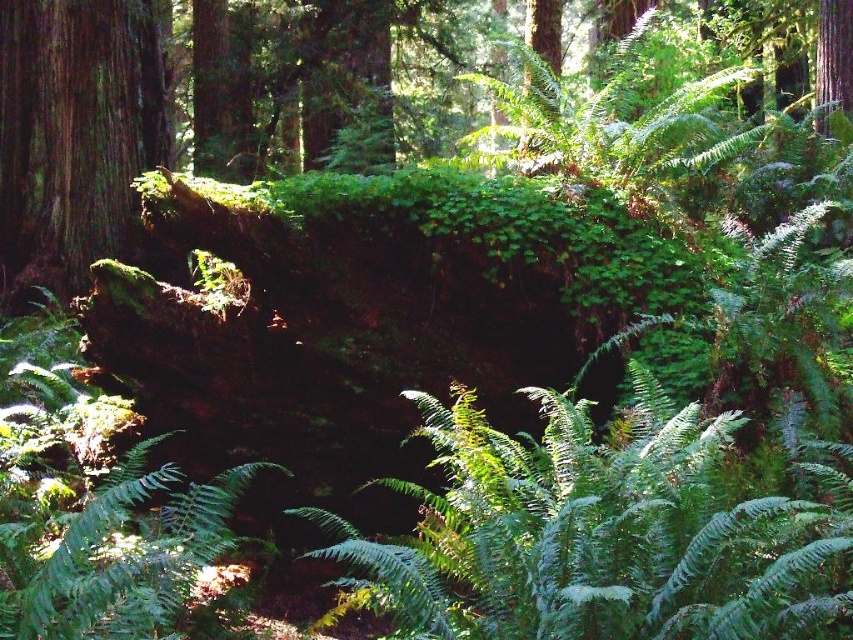
Can you confirm if green leafy fern at center is positioned above green leafy fern at upper center?

No, green leafy fern at center is not above green leafy fern at upper center.

Is point (485, 540) farther from viewer compared to point (477, 145)?

No, (485, 540) is closer to viewer.

Is point (825, 538) farther from viewer compared to point (648, 124)?

No, it is in front of (648, 124).

The image size is (853, 640). I want to click on green leafy fern at center, so click(599, 532).

Between green leafy fern at center and green mossy log at left, which one appears on the left side from the viewer's perspective?

green mossy log at left is more to the left.

Locate an element on the screen. green leafy fern at center is located at coordinates (599, 532).

Which is more to the right, green mossy log at left or green leafy fern at upper center?

From the viewer's perspective, green leafy fern at upper center appears more on the right side.

Does point (64, 96) lie behind point (506, 92)?

Yes, it is.

Between point (10, 211) and point (552, 128), which one is positioned in front?

Point (552, 128)

Locate an element on the screen. The image size is (853, 640). green mossy log at left is located at coordinates (74, 132).